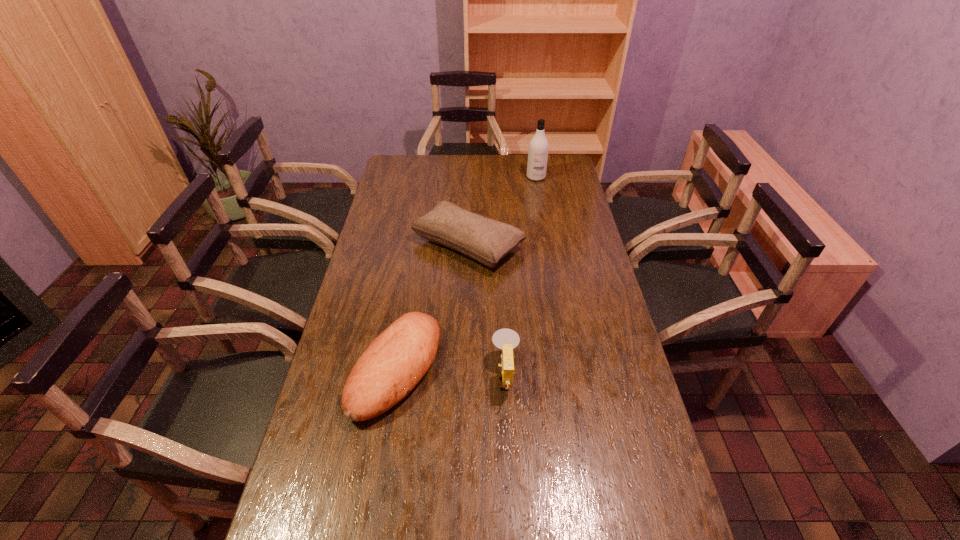
Identify the location of vacant area between the shortest object and the shampoo. (466, 273).

In order to click on free point between the sponge and the farthest object in this screenshot , I will do `click(521, 276)`.

The width and height of the screenshot is (960, 540). In order to click on free spot between the sponge and the bread in this screenshot , I will do `click(451, 372)`.

Find the location of `object that is the closest to the sponge`. object that is the closest to the sponge is located at coordinates (394, 363).

Find the location of `object that is the third closest to the shortest object`. object that is the third closest to the shortest object is located at coordinates (538, 147).

The image size is (960, 540). Identify the location of free space that satisfies the following two spatial constraints: 1. on the front-facing side of the rightmost object; 2. on the front-facing side of the sponge. (571, 376).